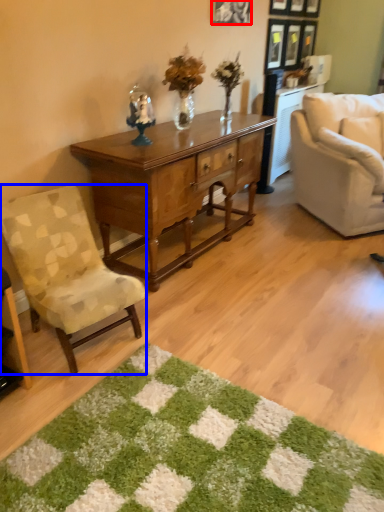
Question: Which object appears farthest to the camera in this image, picture frame (highlighted by a red box) or chair (highlighted by a blue box)?

Choices:
 (A) picture frame
 (B) chair

Answer: (A)